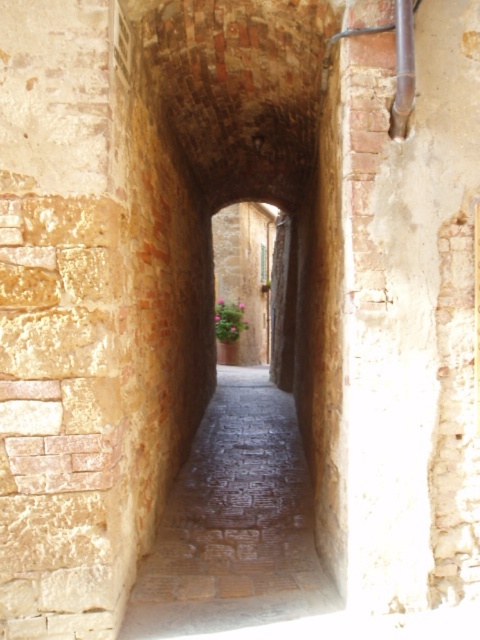
Question: Among these objects, which one is farthest from the camera?

Choices:
 (A) brick tunnel at center
 (B) smooth stone path at center

Answer: (B)

Question: Is brick tunnel at center closer to the viewer compared to smooth stone path at center?

Choices:
 (A) yes
 (B) no

Answer: (A)

Question: Is brick tunnel at center positioned in front of smooth stone path at center?

Choices:
 (A) yes
 (B) no

Answer: (A)

Question: Can you confirm if brick tunnel at center is bigger than smooth stone path at center?

Choices:
 (A) no
 (B) yes

Answer: (B)